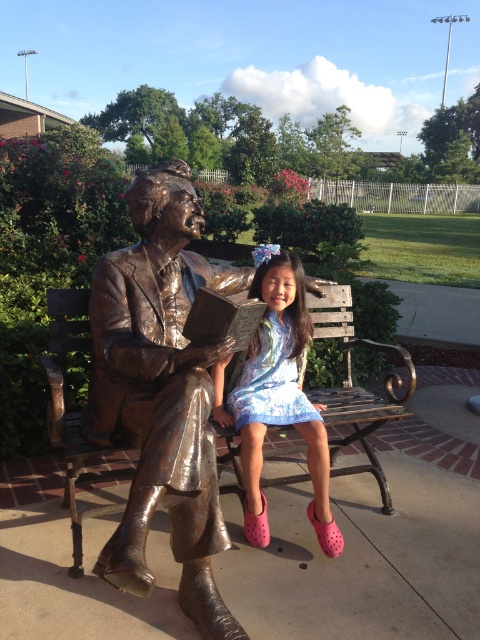
Question: Among these points, which one is farthest from the camera?

Choices:
 (A) (320, 513)
 (B) (101, 307)

Answer: (A)

Question: Which point appears closest to the camera in this image?

Choices:
 (A) (212, 268)
 (B) (312, 406)

Answer: (B)

Question: Which of the following is the closest to the observer?

Choices:
 (A) bronze statue at center
 (B) wooden bench at center

Answer: (A)

Question: Can you confirm if bronze statue at center is positioned to the right of matte blue dress at center?

Choices:
 (A) yes
 (B) no

Answer: (B)

Question: Can you confirm if bronze statue at center is positioned to the right of matte blue dress at center?

Choices:
 (A) no
 (B) yes

Answer: (A)

Question: Is bronze statue at center bigger than wooden bench at center?

Choices:
 (A) no
 (B) yes

Answer: (B)